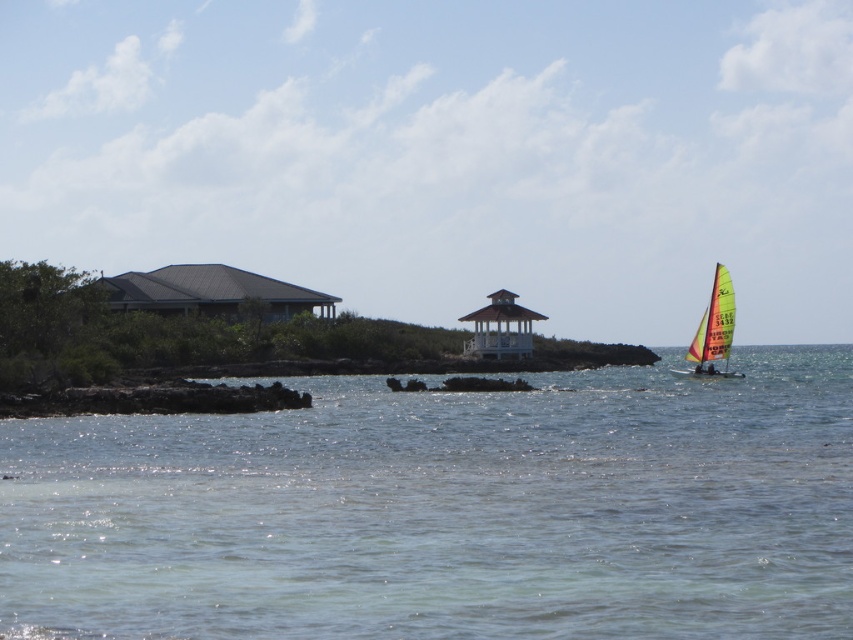
You are standing at the origin point in the image and want to reach the clear water at center. Which direction should you move in terms of the x and y coordinates?

To reach the clear water at center located at point [447,512], you should move in the positive x and positive y direction since both coordinates are greater than 0.

You are standing at the point with coordinates point (x=503, y=339) and want to walk towards the point with coordinates point (x=419, y=500). Which direction should you move relative to your current position?

You should move forward because point (x=419, y=500) is in front of point (x=503, y=339).